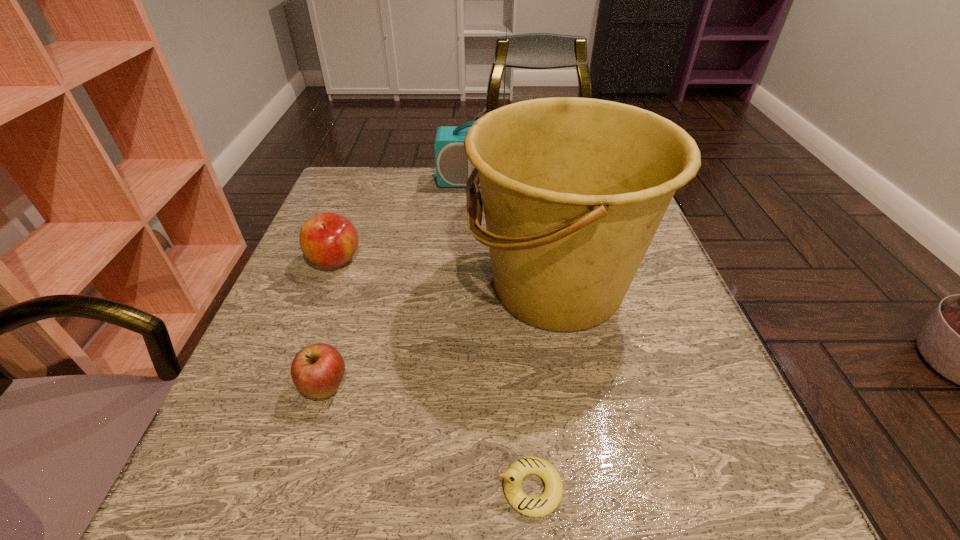
In order to click on empty space between the farthest object and the farther apple in this screenshot , I will do `click(410, 221)`.

Identify the location of free space that is in between the farther apple and the second nearest object. The height and width of the screenshot is (540, 960). (330, 324).

I want to click on blank region between the shortest object and the farther apple, so click(433, 374).

This screenshot has height=540, width=960. Identify the location of object that stands as the closest to the farthest object. (574, 189).

Identify which object is located as the fourth nearest to the nearer apple. Please provide its 2D coordinates. Your answer should be formatted as a tuple, i.e. [(x, y)], where the tuple contains the x and y coordinates of a point satisfying the conditions above.

[(453, 168)]